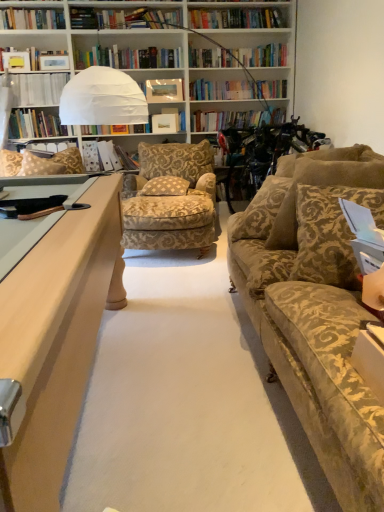
Question: Is patterned fabric pillow at left, the 4th pillow when ordered from right to left, further to the viewer compared to brown textured pillow at right, which appears as the 2th pillow when viewed from the front?

Choices:
 (A) yes
 (B) no

Answer: (A)

Question: Considering the relative positions of patterned fabric pillow at left, which is counted as the 4th pillow, starting from the front, and brown textured pillow at right, positioned as the fourth pillow in left-to-right order, in the image provided, is patterned fabric pillow at left, which is counted as the 4th pillow, starting from the front, in front of brown textured pillow at right, positioned as the fourth pillow in left-to-right order,?

Choices:
 (A) no
 (B) yes

Answer: (A)

Question: Does patterned fabric pillow at left, the 1th pillow when ordered from left to right, have a smaller size compared to brown textured pillow at right, positioned as the fourth pillow in left-to-right order?

Choices:
 (A) no
 (B) yes

Answer: (B)

Question: Is patterned fabric pillow at left, which is counted as the 4th pillow, starting from the front, facing towards brown textured pillow at right, the 3th pillow from the back?

Choices:
 (A) no
 (B) yes

Answer: (B)

Question: Is patterned fabric pillow at left, which is counted as the 4th pillow, starting from the front, at the right side of brown textured pillow at right, the first pillow when ordered from right to left?

Choices:
 (A) yes
 (B) no

Answer: (B)

Question: From a real-world perspective, is patterned fabric pillow at left, the 4th pillow when ordered from right to left, positioned under brown textured pillow at right, positioned as the fourth pillow in left-to-right order, based on gravity?

Choices:
 (A) no
 (B) yes

Answer: (B)

Question: Is matte white photo frame at center positioned in front of matte white folder at center, which ranks as the 1th book in bottom-to-top order?

Choices:
 (A) yes
 (B) no

Answer: (B)

Question: Would you consider matte white photo frame at center to be distant from matte white folder at center, which ranks as the 1th book in bottom-to-top order?

Choices:
 (A) no
 (B) yes

Answer: (A)

Question: Is matte white photo frame at center looking in the opposite direction of matte white folder at center, which is counted as the 2th book, starting from the left?

Choices:
 (A) yes
 (B) no

Answer: (B)

Question: Can you confirm if matte white photo frame at center is wider than matte white folder at center, which ranks as the 1th book in bottom-to-top order?

Choices:
 (A) yes
 (B) no

Answer: (B)

Question: Is matte white photo frame at center positioned beyond the bounds of matte white folder at center, which ranks as the 1th book in bottom-to-top order?

Choices:
 (A) yes
 (B) no

Answer: (A)

Question: Does matte white photo frame at center have a smaller size compared to matte white folder at center, which ranks as the 1th book in bottom-to-top order?

Choices:
 (A) no
 (B) yes

Answer: (B)

Question: From the image's perspective, is matte white photo frame at center beneath brown textured pillow at right, which appears as the 2th pillow when viewed from the front?

Choices:
 (A) yes
 (B) no

Answer: (B)